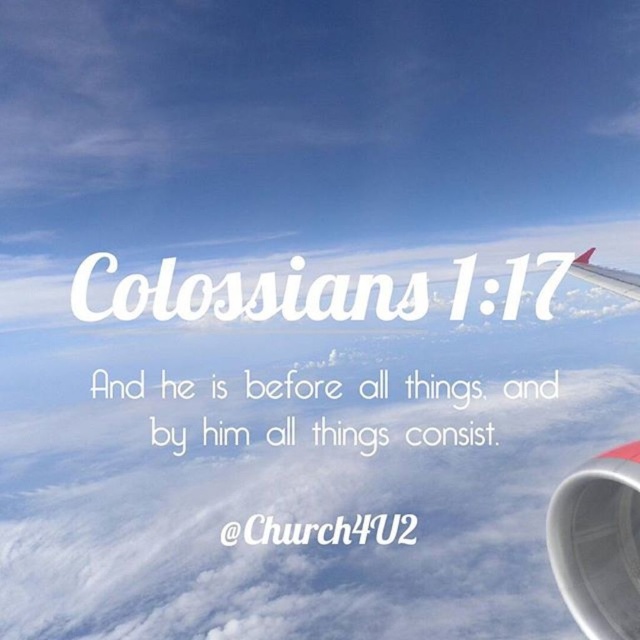
Is white metallic engine at right above red matte wing at upper right?

Actually, white metallic engine at right is below red matte wing at upper right.

Does white metallic engine at right come behind red matte wing at upper right?

No, it is in front of red matte wing at upper right.

This screenshot has height=640, width=640. What do you see at coordinates (598, 544) in the screenshot? I see `white metallic engine at right` at bounding box center [598, 544].

Identify the location of white metallic engine at right. (598, 544).